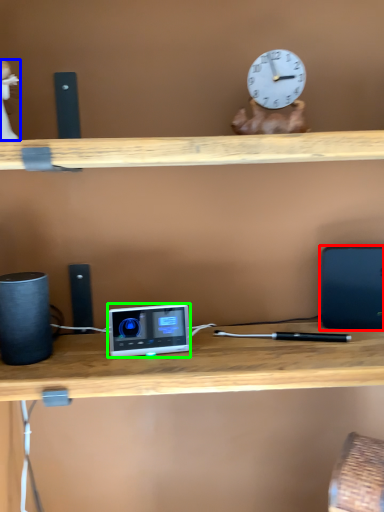
Question: Considering the real-world distances, which object is farthest from laptop (highlighted by a red box)? toy (highlighted by a blue box) or ipod (highlighted by a green box)?

Choices:
 (A) toy
 (B) ipod

Answer: (A)